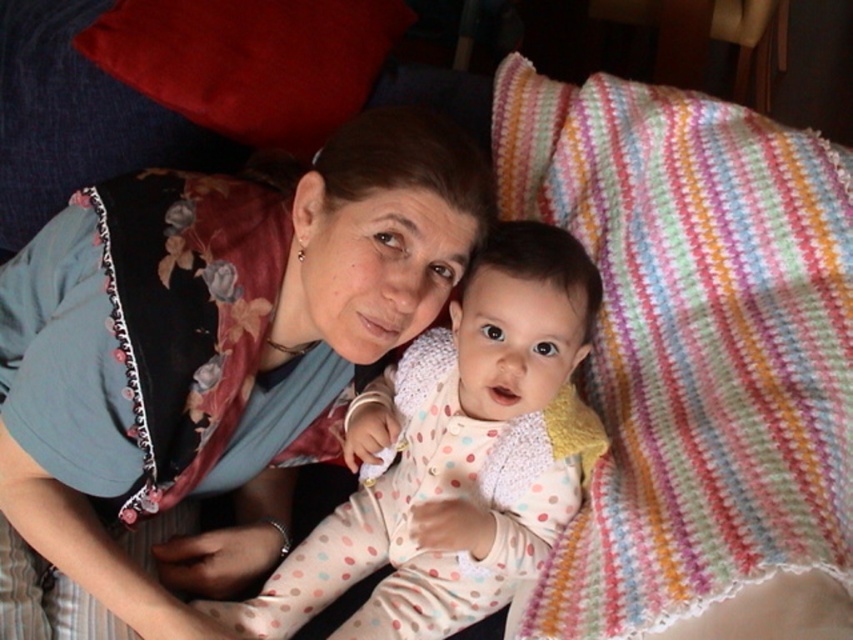
Question: From the image, what is the correct spatial relationship of matte blue shirt at center in relation to velvety red pillow at upper left?

Choices:
 (A) right
 (B) left

Answer: (B)

Question: Which of the following is the closest to the observer?

Choices:
 (A) velvety red pillow at upper left
 (B) multicolored knitted blanket at upper right
 (C) polka dot fabric baby at center
 (D) matte blue shirt at center

Answer: (B)

Question: Is multicolored knitted blanket at upper right above polka dot fabric baby at center?

Choices:
 (A) no
 (B) yes

Answer: (B)

Question: Considering the real-world distances, which object is farthest from the polka dot fabric baby at center?

Choices:
 (A) velvety red pillow at upper left
 (B) matte blue shirt at center

Answer: (A)

Question: Does multicolored knitted blanket at upper right come behind polka dot fabric baby at center?

Choices:
 (A) no
 (B) yes

Answer: (A)

Question: Estimate the real-world distances between objects in this image. Which object is closer to the matte blue shirt at center?

Choices:
 (A) multicolored knitted blanket at upper right
 (B) velvety red pillow at upper left
 (C) polka dot fabric baby at center

Answer: (C)